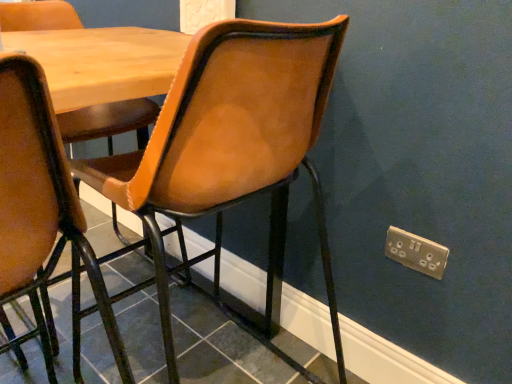
Question: From a real-world perspective, is matte black tile at lower center physically above gold metallic electric outlet at lower right?

Choices:
 (A) no
 (B) yes

Answer: (A)

Question: From a real-world perspective, is matte black tile at lower center below gold metallic electric outlet at lower right?

Choices:
 (A) yes
 (B) no

Answer: (A)

Question: Is matte black tile at lower center at the right side of gold metallic electric outlet at lower right?

Choices:
 (A) no
 (B) yes

Answer: (A)

Question: Is matte black tile at lower center surrounding gold metallic electric outlet at lower right?

Choices:
 (A) yes
 (B) no

Answer: (B)

Question: From the image's perspective, is matte black tile at lower center located above gold metallic electric outlet at lower right?

Choices:
 (A) no
 (B) yes

Answer: (A)

Question: Does matte black tile at lower center appear on the left side of gold metallic electric outlet at lower right?

Choices:
 (A) yes
 (B) no

Answer: (A)

Question: From a real-world perspective, does leather-like brown chair at center stand above matte black tile at lower center?

Choices:
 (A) yes
 (B) no

Answer: (A)

Question: Is leather-like brown chair at center turned away from matte black tile at lower center?

Choices:
 (A) no
 (B) yes

Answer: (A)

Question: Does leather-like brown chair at center have a lesser width compared to matte black tile at lower center?

Choices:
 (A) yes
 (B) no

Answer: (A)

Question: Does leather-like brown chair at center have a smaller size compared to matte black tile at lower center?

Choices:
 (A) no
 (B) yes

Answer: (A)

Question: Is leather-like brown chair at center directly adjacent to matte black tile at lower center?

Choices:
 (A) no
 (B) yes

Answer: (A)

Question: Is leather-like brown chair at center facing towards matte black tile at lower center?

Choices:
 (A) yes
 (B) no

Answer: (B)

Question: From the image's perspective, is matte black tile at lower center below wooden table at center?

Choices:
 (A) yes
 (B) no

Answer: (A)